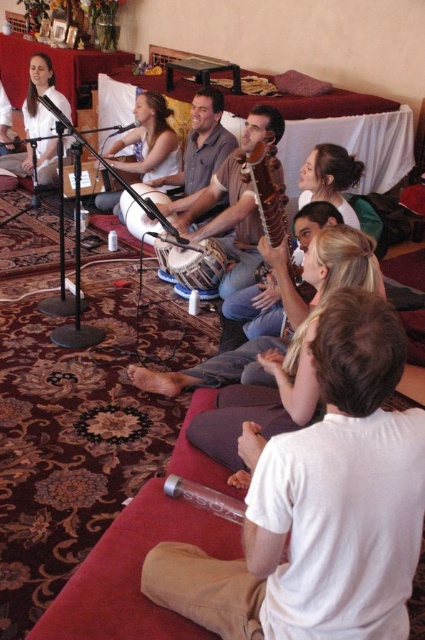
Question: Which point is closer to the camera?

Choices:
 (A) (146, 184)
 (B) (113, 144)

Answer: (A)

Question: Can you confirm if wooden drum at center is thinner than matte brown tabla at center?

Choices:
 (A) no
 (B) yes

Answer: (A)

Question: Does white t-shirt at lower right appear on the left side of wooden drum at center?

Choices:
 (A) yes
 (B) no

Answer: (B)

Question: From the image, what is the correct spatial relationship of white t-shirt at lower right in relation to matte white shirt at center?

Choices:
 (A) above
 (B) below

Answer: (B)

Question: Which of the following is the farthest from the observer?

Choices:
 (A) wooden drum at center
 (B) matte white shirt at center
 (C) matte brown tabla at center

Answer: (B)

Question: Based on their relative distances, which object is farther from the wooden guitar at center?

Choices:
 (A) matte white shirt at center
 (B) white t-shirt at lower right

Answer: (A)